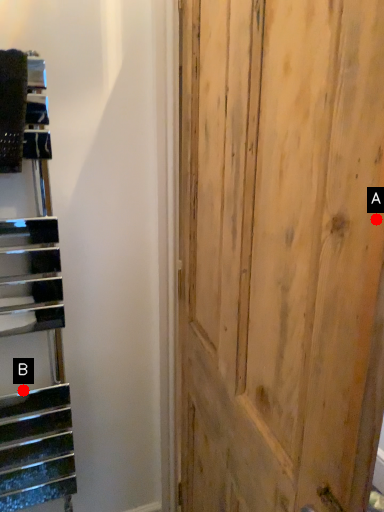
Question: Two points are circled on the image, labeled by A and B beside each circle. Among these points, which one is nearest to the camera?

Choices:
 (A) A is closer
 (B) B is closer

Answer: (A)